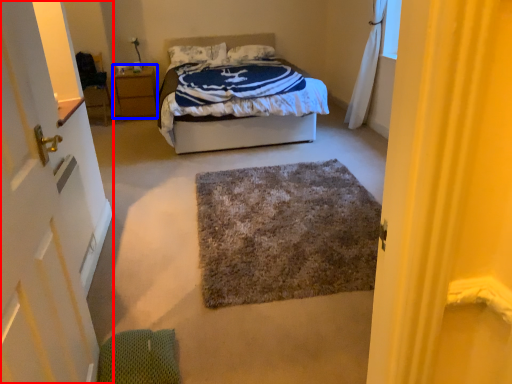
Question: Which object appears farthest to the camera in this image, door (highlighted by a red box) or nightstand (highlighted by a blue box)?

Choices:
 (A) door
 (B) nightstand

Answer: (B)